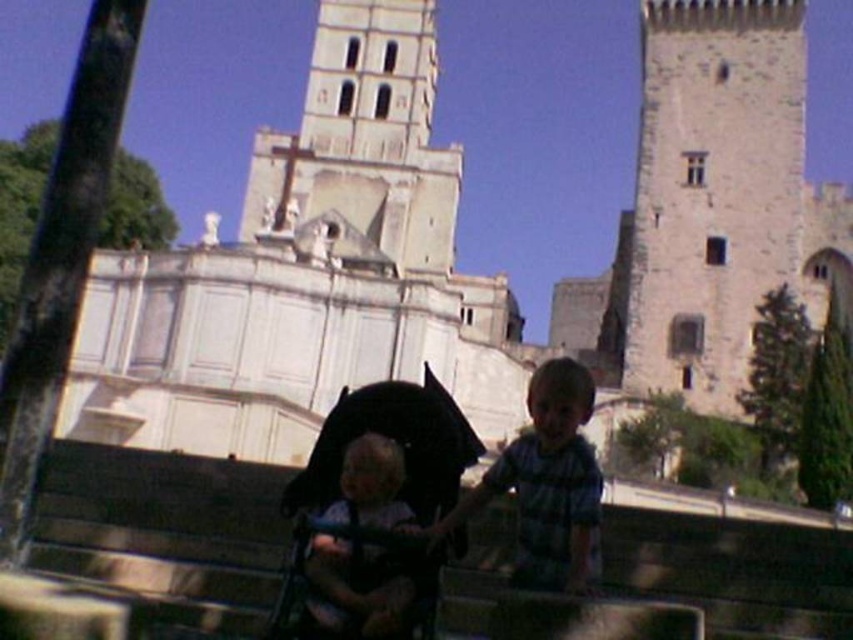
Question: Is striped cotton shirt at center in front of light brown hair at center?

Choices:
 (A) no
 (B) yes

Answer: (A)

Question: Can you confirm if black fabric baby carriage at center is positioned above striped cotton shirt at center?

Choices:
 (A) yes
 (B) no

Answer: (B)

Question: Which object is the closest to the white stone tower at upper center?

Choices:
 (A) light brown hair at center
 (B) striped cotton shirt at center
 (C) white stone castle at center

Answer: (C)

Question: Considering the real-world distances, which object is farthest from the light brown hair at center?

Choices:
 (A) white stone castle at center
 (B) white stone tower at upper center
 (C) striped cotton shirt at center

Answer: (B)

Question: Can you confirm if striped cotton shirt at center is smaller than light brown hair at center?

Choices:
 (A) no
 (B) yes

Answer: (A)

Question: Based on their relative distances, which object is farther from the white stone castle at center?

Choices:
 (A) black fabric baby carriage at center
 (B) white stone tower at upper center
 (C) striped cotton shirt at center

Answer: (A)